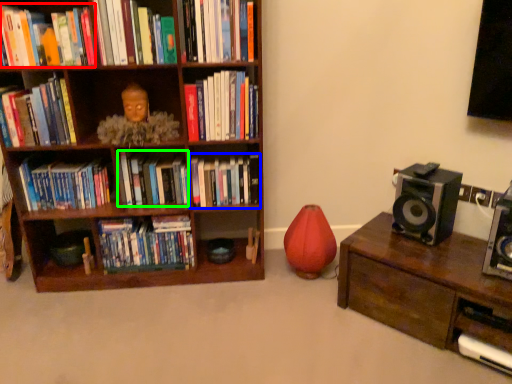
Question: Which object is the farthest from book (highlighted by a red box)? Choose among these: book (highlighted by a blue box) or book (highlighted by a green box).

Choices:
 (A) book
 (B) book

Answer: (A)